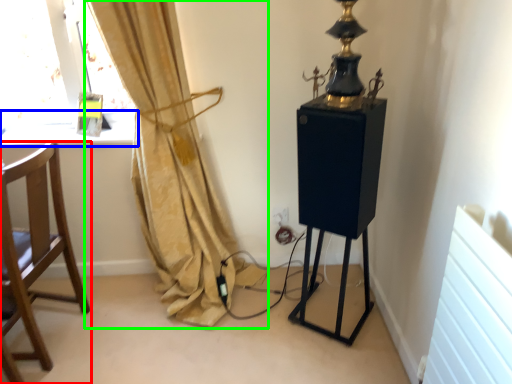
Question: Based on their relative distances, which object is farther from chair (highlighted by a red box)? Choose from window sill (highlighted by a blue box) and curtain (highlighted by a green box).

Choices:
 (A) window sill
 (B) curtain

Answer: (A)